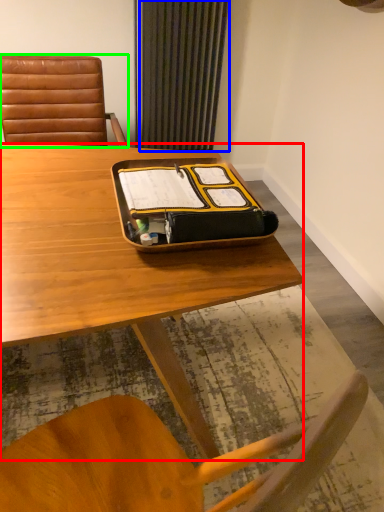
Question: Which object is positioned closest to desk (highlighted by a red box)? Select from curtain (highlighted by a blue box) and chair (highlighted by a green box).

Choices:
 (A) curtain
 (B) chair

Answer: (B)